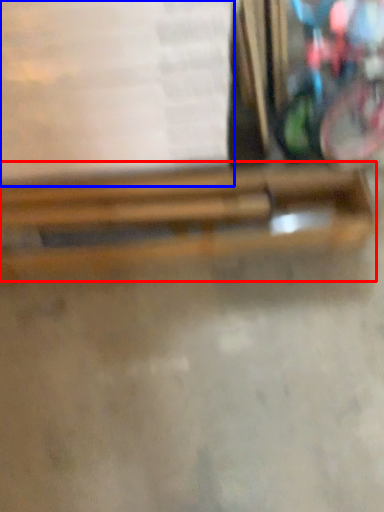
Question: Which object is closer to the camera taking this photo, wood (highlighted by a red box) or paperback book (highlighted by a blue box)?

Choices:
 (A) wood
 (B) paperback book

Answer: (B)